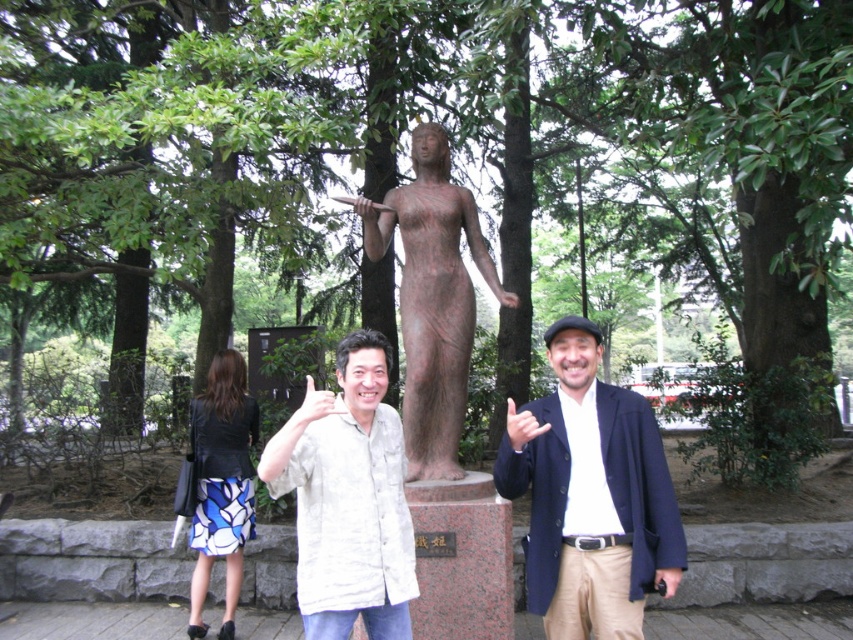
You are standing in front of the statue and want to place two markers at the coordinates point (367, 602) and point (206, 532). Which marker will be closer to your position?

Point (367, 602) is closer to the viewer than point (206, 532), so the marker at point (367, 602) will be closer to your position.

You are a photographer setting up a shoot in the park. You have a camera with a 1.2 meter wide lens. You need to capture both the dark blue fabric jacket at center and the bronze statue at center in the same frame. Can you fit both objects horizontally within the camera lens width?

The dark blue fabric jacket at center is narrower than the bronze statue at center. However, the combined width of both objects would depend on their individual widths and the distance between them. Since the camera lens is 1.2 meters wide, it might be possible if the total width of both objects together is less than or equal to 1.2 meters. Without specific measurements of each object and their spacing, an exact determination cannot be made. However, since the jacket is narrower than the statue, arranging

You are a photographer trying to capture a photo of the bronze statue at center. However, there is a person wearing a white textured shirt at center blocking your view. Can you estimate whether the person is smaller in size than the statue?

The white textured shirt at center occupies less space than bronze statue at center, so yes, the person wearing the white textured shirt at center is smaller in size than the bronze statue at center and is blocking the view.